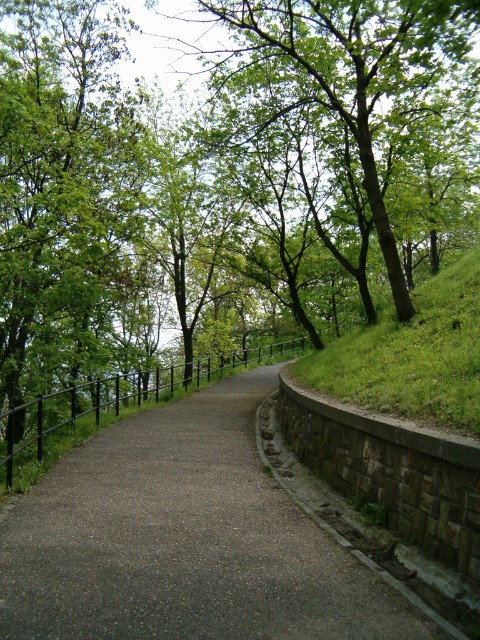
Question: Can you confirm if dark gray asphalt road at center is smaller than green leafy tree at upper left?

Choices:
 (A) no
 (B) yes

Answer: (B)

Question: Is dark gray asphalt road at center above black metal fence at center?

Choices:
 (A) yes
 (B) no

Answer: (B)

Question: Estimate the real-world distances between objects in this image. Which object is farther from the green leafy tree at upper center?

Choices:
 (A) green leafy tree at upper left
 (B) dark gray asphalt road at center
 (C) black metal fence at center

Answer: (B)

Question: Which point is closer to the camera taking this photo?

Choices:
 (A) (418, 42)
 (B) (74, 390)
 (C) (13, 612)
 (D) (56, 337)

Answer: (C)

Question: Does dark gray asphalt road at center appear on the right side of green leafy tree at upper left?

Choices:
 (A) yes
 (B) no

Answer: (A)

Question: Among these objects, which one is nearest to the camera?

Choices:
 (A) green leafy tree at upper left
 (B) black metal fence at center

Answer: (B)